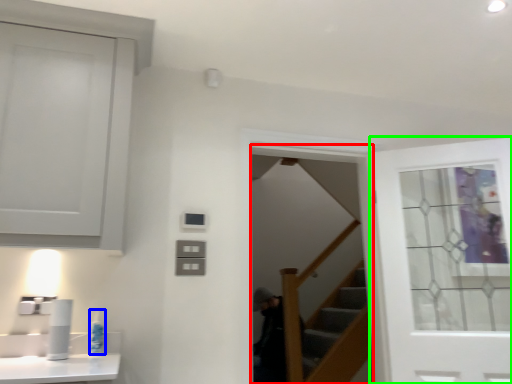
Question: Which object is positioned farthest from screen door (highlighted by a red box)? Select from toiletry (highlighted by a blue box) and door (highlighted by a green box).

Choices:
 (A) toiletry
 (B) door

Answer: (A)